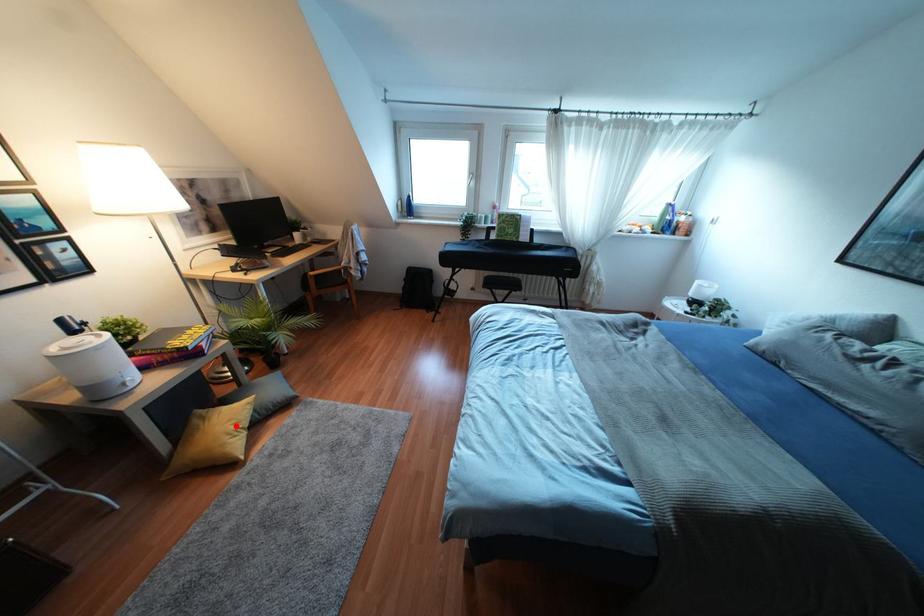
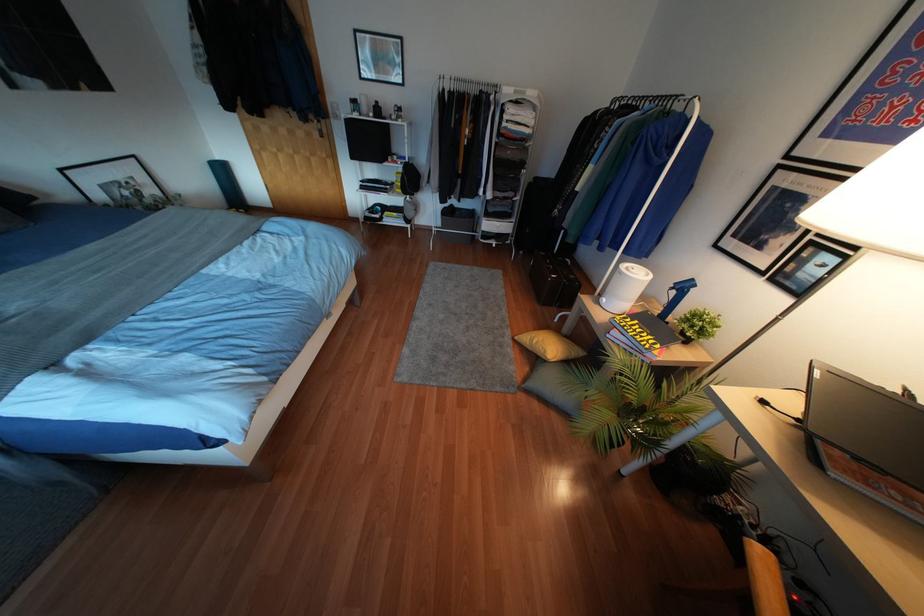
Question: I am providing you with two images of the same scene from different viewpoints. In image1, a red point is highlighted. Considering the same 3D point in image2, which of the following is correct?

Choices:
 (A) It is closer
 (B) It is farther

Answer: (A)